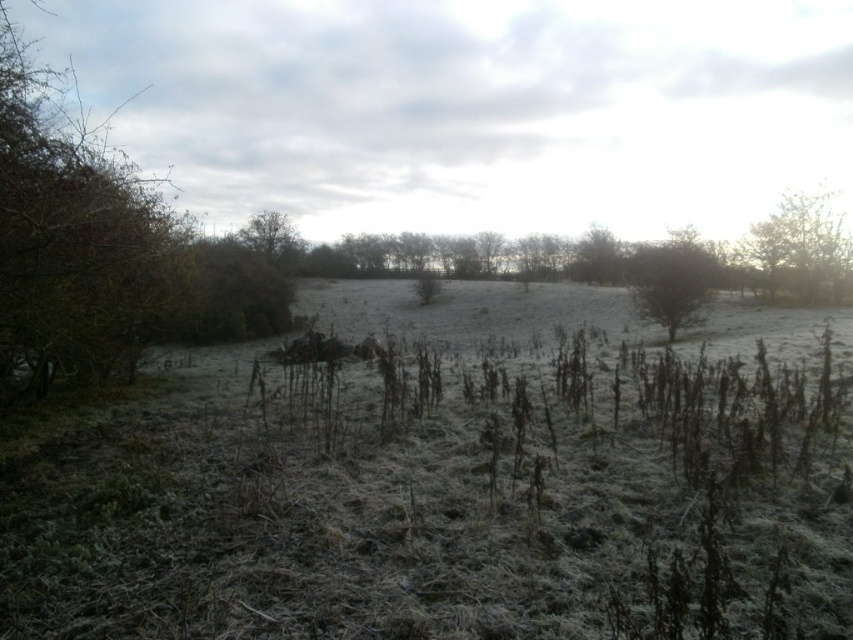
Which is more to the left, brown textured bush at left or brown textured tree at right?

From the viewer's perspective, brown textured bush at left appears more on the left side.

Between brown textured bush at left and brown textured tree at right, which one has less height?

brown textured tree at right is shorter.

What do you see at coordinates (71, 241) in the screenshot? The image size is (853, 640). I see `brown textured bush at left` at bounding box center [71, 241].

I want to click on brown textured bush at left, so click(x=71, y=241).

Does point (82, 288) lie in front of point (587, 266)?

Yes.

Does brown textured bush at left appear under brown textured tree at center?

No, brown textured bush at left is not below brown textured tree at center.

Find the location of a particular element. Image resolution: width=853 pixels, height=640 pixels. brown textured bush at left is located at coordinates (71, 241).

Who is more distant from viewer, (831, 259) or (664, 321)?

Point (831, 259)

Is brown textured tree at right taller than green matte tree at upper right?

Yes.

Who is more distant from viewer, (770, 291) or (654, 269)?

The point (770, 291) is more distant.

Locate an element on the screen. brown textured tree at right is located at coordinates (801, 250).